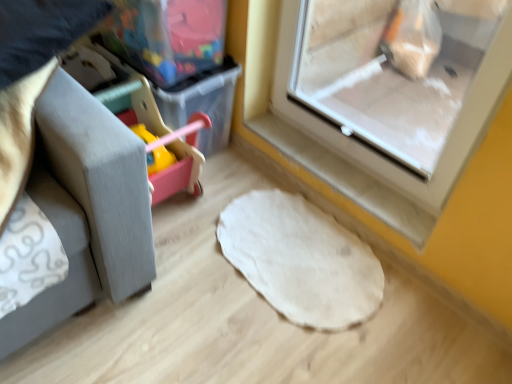
Question: Considering the relative sizes of white felt mat at center and transparent plastic screen door at upper right in the image provided, is white felt mat at center smaller than transparent plastic screen door at upper right?

Choices:
 (A) yes
 (B) no

Answer: (A)

Question: Does white felt mat at center appear on the left side of transparent plastic screen door at upper right?

Choices:
 (A) yes
 (B) no

Answer: (A)

Question: Considering the relative sizes of white felt mat at center and transparent plastic screen door at upper right in the image provided, is white felt mat at center bigger than transparent plastic screen door at upper right?

Choices:
 (A) yes
 (B) no

Answer: (B)

Question: Can you confirm if white felt mat at center is wider than transparent plastic screen door at upper right?

Choices:
 (A) yes
 (B) no

Answer: (A)

Question: Are white felt mat at center and transparent plastic screen door at upper right far apart?

Choices:
 (A) yes
 (B) no

Answer: (B)

Question: From a real-world perspective, is white felt mat at center below transparent plastic screen door at upper right?

Choices:
 (A) no
 (B) yes

Answer: (B)

Question: Does translucent plastic storage box at upper left have a larger size compared to transparent plastic screen door at upper right?

Choices:
 (A) yes
 (B) no

Answer: (B)

Question: Is translucent plastic storage box at upper left shorter than transparent plastic screen door at upper right?

Choices:
 (A) yes
 (B) no

Answer: (A)

Question: Considering the relative sizes of translucent plastic storage box at upper left and transparent plastic screen door at upper right in the image provided, is translucent plastic storage box at upper left wider than transparent plastic screen door at upper right?

Choices:
 (A) no
 (B) yes

Answer: (B)

Question: Does translucent plastic storage box at upper left appear on the left side of transparent plastic screen door at upper right?

Choices:
 (A) no
 (B) yes

Answer: (B)

Question: Is translucent plastic storage box at upper left positioned before transparent plastic screen door at upper right?

Choices:
 (A) no
 (B) yes

Answer: (A)

Question: Is translucent plastic storage box at upper left further to camera compared to transparent plastic screen door at upper right?

Choices:
 (A) no
 (B) yes

Answer: (B)

Question: Is transparent plastic screen door at upper right far from white felt mat at center?

Choices:
 (A) yes
 (B) no

Answer: (B)